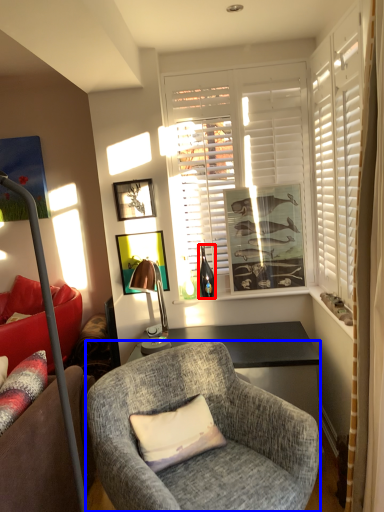
Question: Which object is further to the camera taking this photo, bottle (highlighted by a red box) or chair (highlighted by a blue box)?

Choices:
 (A) bottle
 (B) chair

Answer: (A)